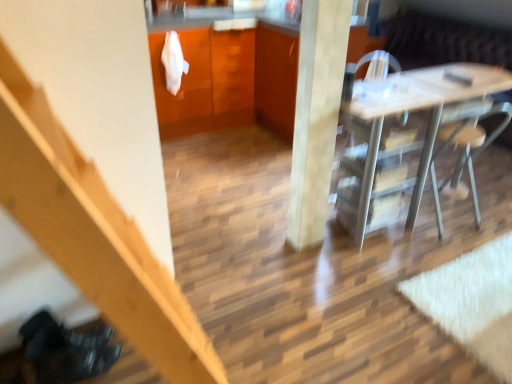
Locate an element on the screen. The height and width of the screenshot is (384, 512). vacant area that lies to the right of smooth light wood pillar at center is located at coordinates (344, 244).